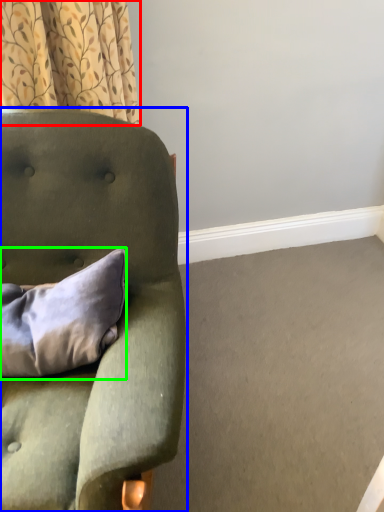
Question: Which object is the closest to the curtain (highlighted by a red box)? Choose among these: chair (highlighted by a blue box) or pillow (highlighted by a green box).

Choices:
 (A) chair
 (B) pillow

Answer: (A)